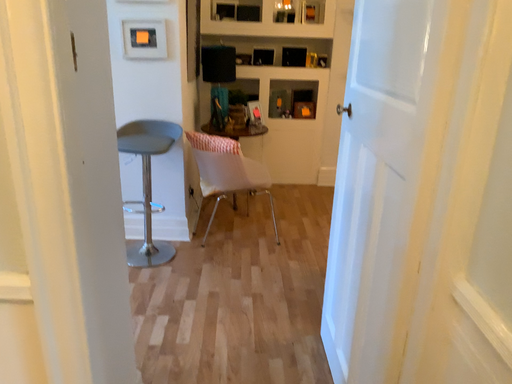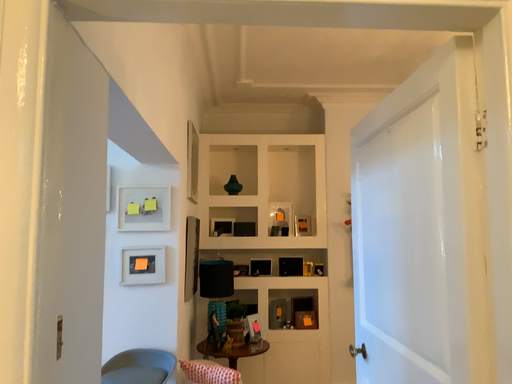
Question: Which way did the camera rotate in the video?

Choices:
 (A) rotated upward
 (B) rotated downward

Answer: (A)